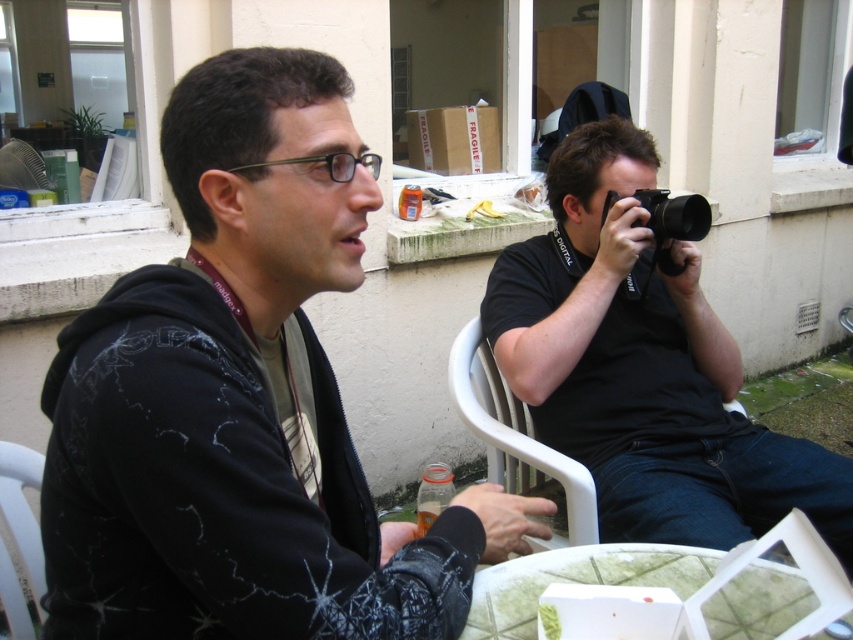
You are a photographer trying to capture a photo of the black matte hoodie at center and the white glass table at lower center. To ensure both are in frame, you need to know their relative positions. Which object is located to the left of the other?

The black matte hoodie at center is positioned on the left side of white glass table at lower center.

You are a photographer trying to capture both the black matte hoodie at center and the white glass table at lower center in a single frame. Based on their sizes, which object would appear larger in the photo?

The black matte hoodie at center would appear larger in the photo since it is bigger than the white glass table at lower center according to the description.

You are standing at the back of the patio and want to take a photo of the scene. If you move forward to the black plastic camera at center, will the white plastic chair at lower left block your view of the camera?

The white plastic chair at lower left is in front of the black plastic camera at center, so moving forward to the camera would mean the chair is between you and the camera, blocking your view.